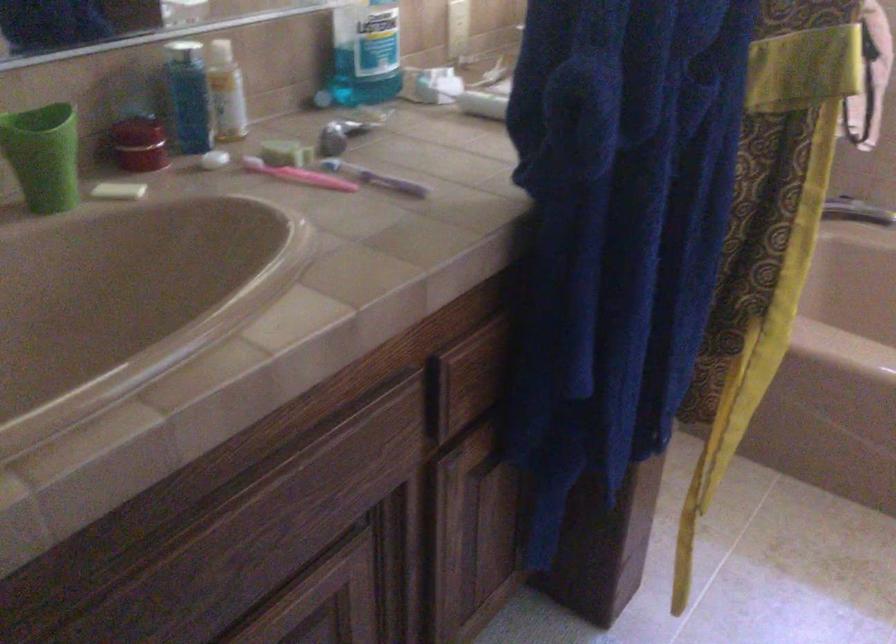
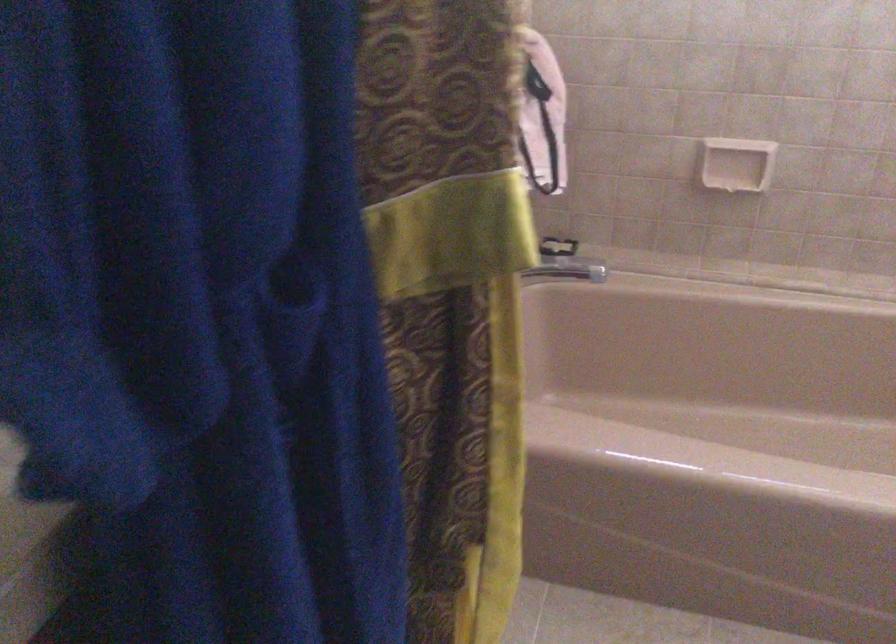
What movement of the cameraman would produce the second image?

The movement direction of the cameraman is right, forward.